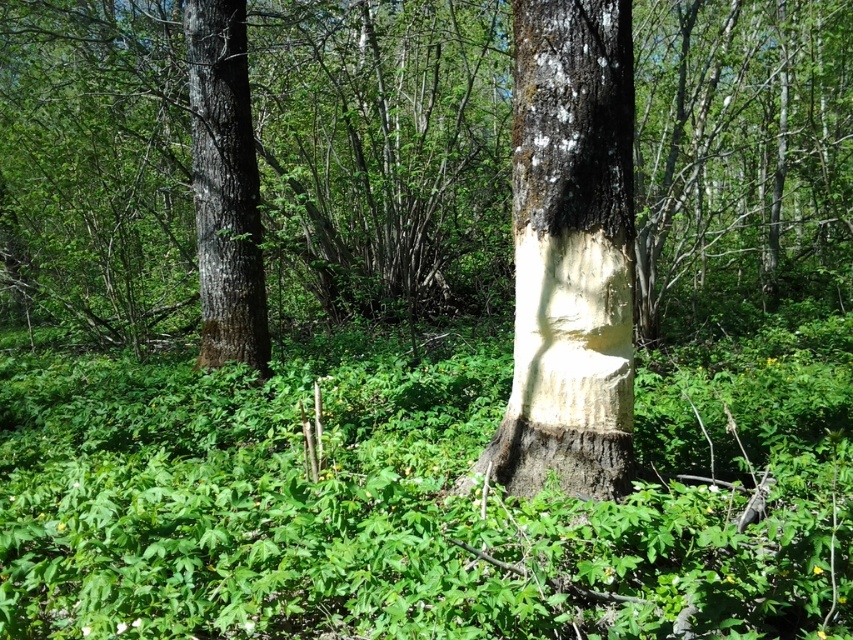
Based on the photo, does smooth white bark at center appear on the right side of smooth bark tree trunk at left?

Yes, smooth white bark at center is to the right of smooth bark tree trunk at left.

Which is in front, point (614, 358) or point (200, 342)?

Point (614, 358) is more forward.

Is point (514, 173) positioned in front of point (216, 152)?

Yes, it is in front of point (216, 152).

Find the location of a particular element. smooth white bark at center is located at coordinates (569, 253).